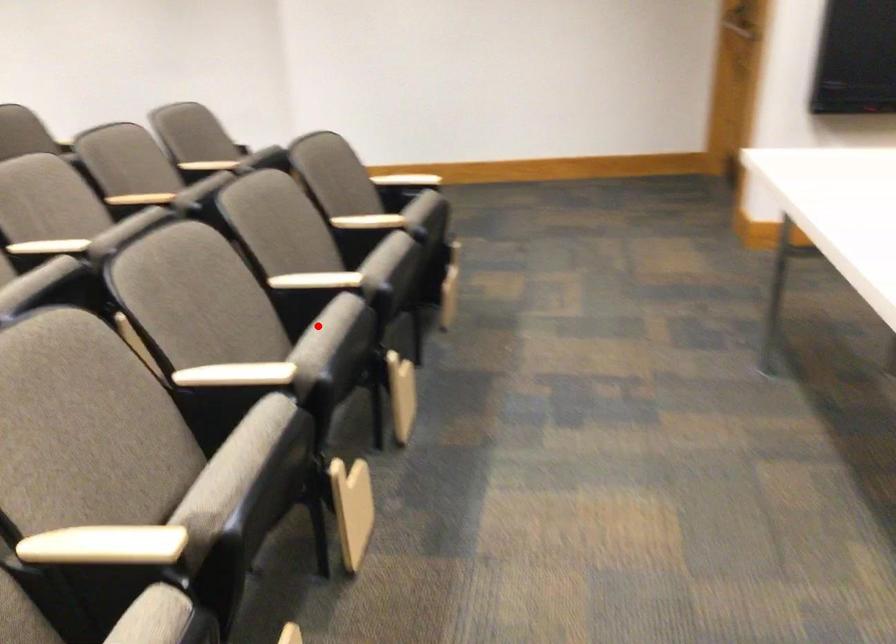
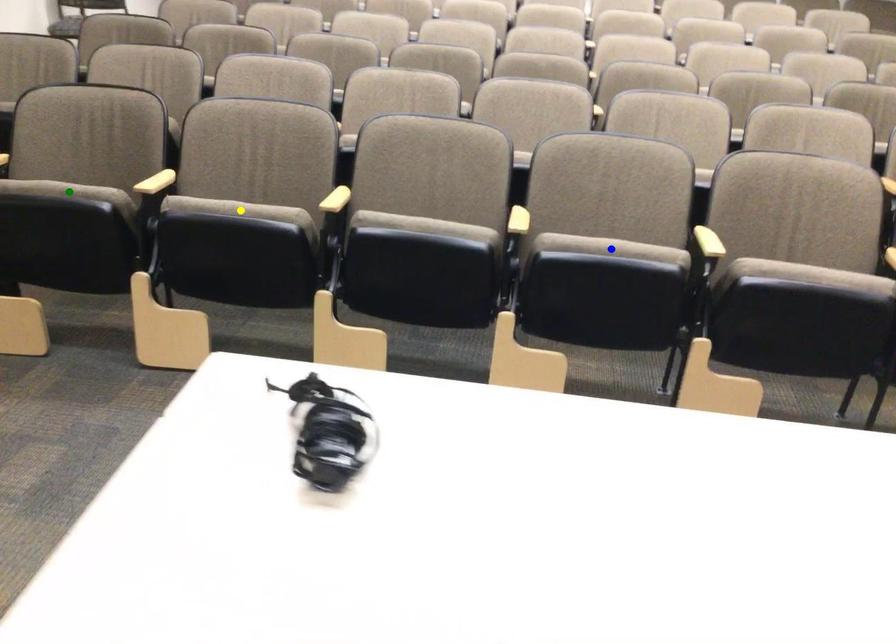
Question: I am providing you with two images of the same scene from different viewpoints. A red point is marked on the first image. You are given multiple points on the second image. In image 2, which mark is for the same physical point as the one in image 1?

Choices:
 (A) yellow point
 (B) blue point
 (C) green point

Answer: (B)